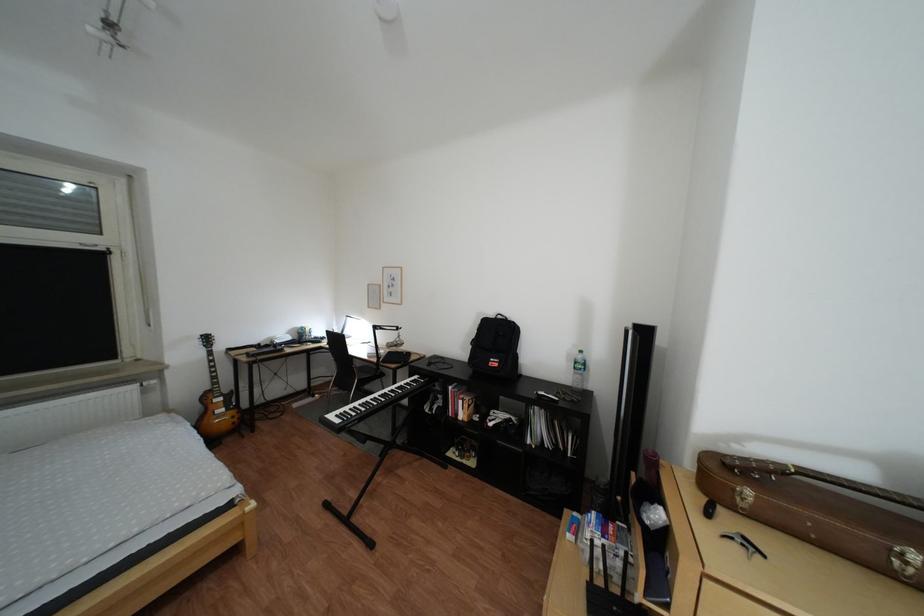
Find the location of `window handle`. window handle is located at coordinates (95, 246).